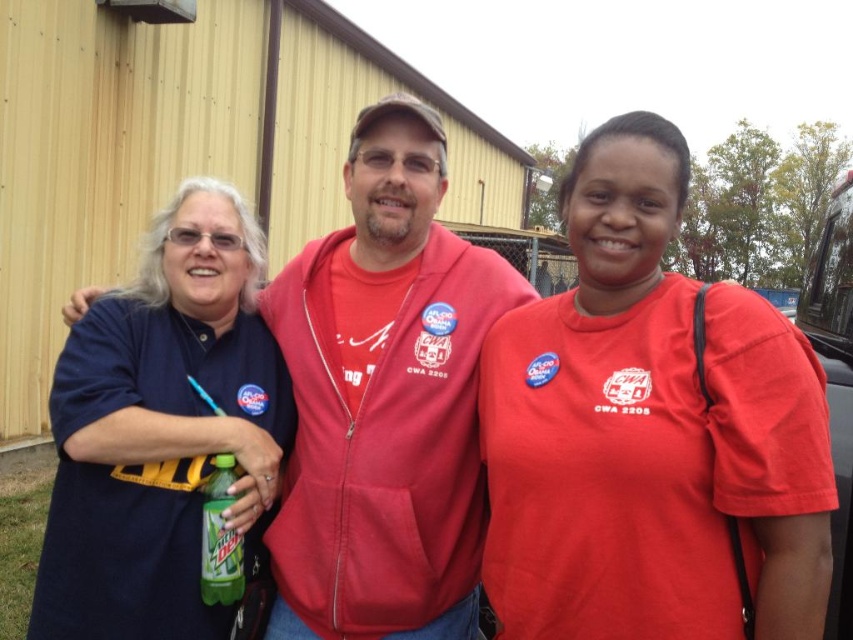
Question: Considering the relative positions of matte red shirt at center and green matte mountain dew bottle at center in the image provided, where is matte red shirt at center located with respect to green matte mountain dew bottle at center?

Choices:
 (A) below
 (B) above

Answer: (B)

Question: Is the position of matte red hoodie at center less distant than that of green matte mountain dew bottle at center?

Choices:
 (A) yes
 (B) no

Answer: (B)

Question: Considering the relative positions of navy blue shirt at left and green matte mountain dew bottle at center in the image provided, where is navy blue shirt at left located with respect to green matte mountain dew bottle at center?

Choices:
 (A) right
 (B) left

Answer: (B)

Question: Based on their relative distances, which object is nearer to the navy blue shirt at left?

Choices:
 (A) matte red hoodie at center
 (B) green matte mountain dew bottle at center
 (C) matte red shirt at center

Answer: (B)

Question: Estimate the real-world distances between objects in this image. Which object is farther from the green matte mountain dew bottle at center?

Choices:
 (A) matte red hoodie at center
 (B) matte red shirt at center

Answer: (B)

Question: Which point is farther to the camera?

Choices:
 (A) navy blue shirt at left
 (B) matte red hoodie at center
 (C) green matte mountain dew bottle at center

Answer: (B)